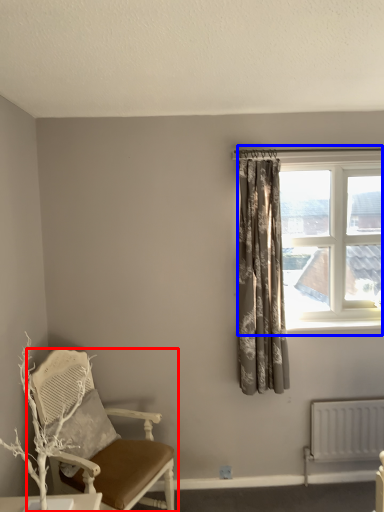
Question: Which object appears farthest to the camera in this image, chair (highlighted by a red box) or window (highlighted by a blue box)?

Choices:
 (A) chair
 (B) window

Answer: (B)